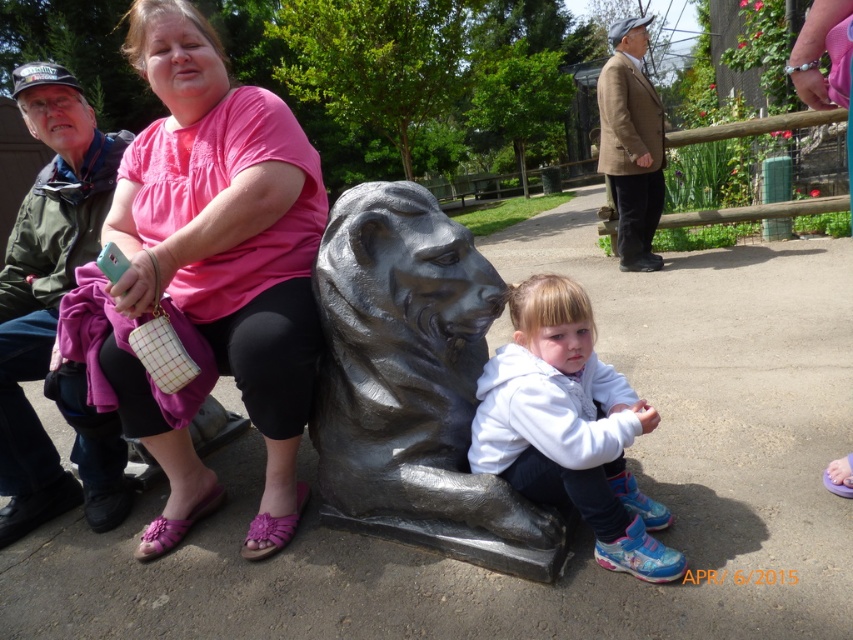
You are a photographer standing in front of the lion sculpture. You want to take a photo of both the woman on the lion and the child sitting nearby. The points you need to focus on are point 1 at coordinates point (224, 296) and point 2 at coordinates point (490, 412). Which point should you focus on first to ensure both subjects are in focus?

You should focus on point 1 at coordinates point (224, 296) first because it is closer to the camera than point 2 at coordinates point (490, 412). This ensures both subjects are within the depth of field.

You are a photographer trying to capture a photo of both the polished bronze lion at center and the white fleece jacket at center in the same frame. Given that your camera has a minimum focus distance of 10 inches, will you be able to focus on both subjects clearly?

The polished bronze lion at center and white fleece jacket at center are 9.80 inches apart, which is less than the camera minimum focus distance of 10 inches. Therefore, the camera may not be able to focus both subjects clearly in the same frame.